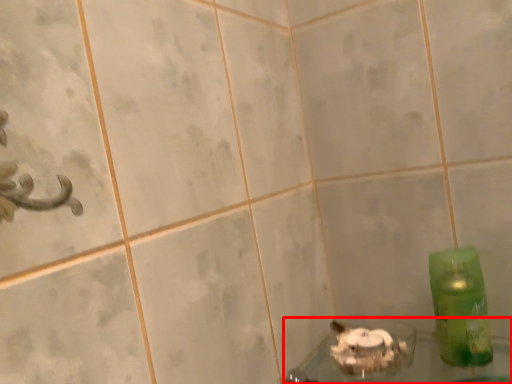
Question: Observing the image, what is the correct spatial positioning of bath (annotated by the red box) in reference to bottle?

Choices:
 (A) left
 (B) right

Answer: (A)